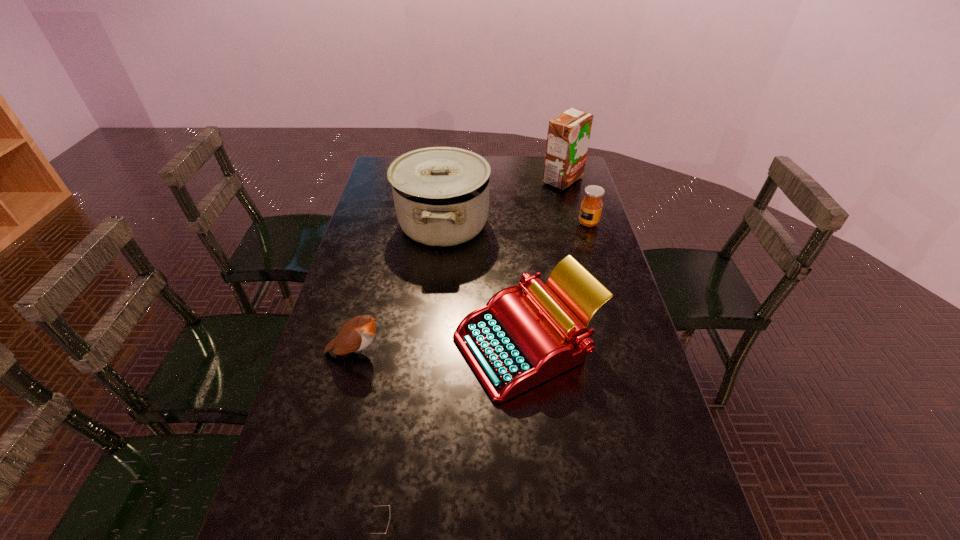
You are a GUI agent. You are given a task and a screenshot of the screen. Output one action in this format:
    pyautogui.click(x=<x>, y=<y>)
    Task: Click on the empty space between the bird and the saucepan
    
    Given the screenshot: What is the action you would take?
    pyautogui.click(x=399, y=288)

The height and width of the screenshot is (540, 960). Find the location of `vacant region between the honey and the fifth shortest object`. vacant region between the honey and the fifth shortest object is located at coordinates (516, 224).

Where is `vacant point located between the typewriter and the bird`? Image resolution: width=960 pixels, height=540 pixels. vacant point located between the typewriter and the bird is located at coordinates (442, 349).

Where is `object that ranks as the fourth closest to the typewriter`? Image resolution: width=960 pixels, height=540 pixels. object that ranks as the fourth closest to the typewriter is located at coordinates pos(591,207).

At what (x,y) coordinates should I click in order to perform the action: click on the closest object to the typewriter. Please return your answer as a coordinate pair (x, y). The width and height of the screenshot is (960, 540). Looking at the image, I should click on (441, 194).